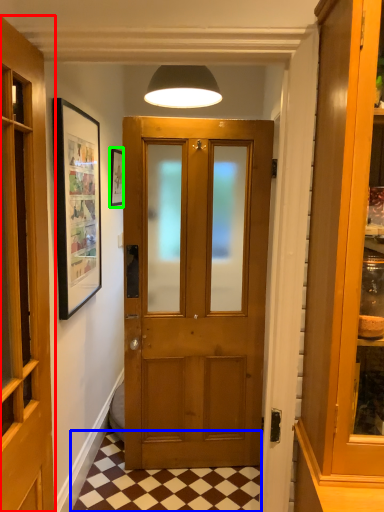
Question: Which object is the farthest from door (highlighted by a red box)? Choose among these: tile (highlighted by a blue box) or picture frame (highlighted by a green box).

Choices:
 (A) tile
 (B) picture frame

Answer: (B)